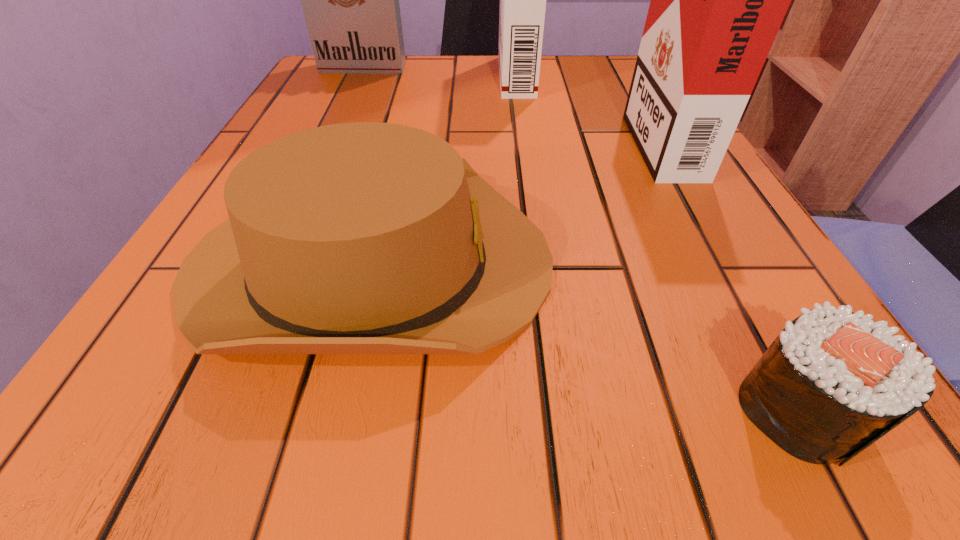
At what (x,y) coordinates should I click in order to perform the action: click on vacant space located 0.270m on the front-facing side of the nearest cigarette case. Please return your answer as a coordinate pair (x, y). This screenshot has height=540, width=960. Looking at the image, I should click on (481, 139).

This screenshot has width=960, height=540. Identify the location of vacant position located on the front-facing side of the nearest cigarette case. (453, 139).

Image resolution: width=960 pixels, height=540 pixels. I want to click on free location located 0.230m on the front-facing side of the fourth tallest object, so (x=732, y=262).

The width and height of the screenshot is (960, 540). Identify the location of free space located 0.220m on the left of the sushi. (511, 409).

The height and width of the screenshot is (540, 960). What are the coordinates of `object present at the near edge` in the screenshot? It's located at (832, 383).

At what (x,y) coordinates should I click in order to perform the action: click on cigarette case at the left edge. Please return your answer as a coordinate pair (x, y). The image size is (960, 540). Looking at the image, I should click on (350, 0).

Where is `cowboy hat that is at the left edge`? The width and height of the screenshot is (960, 540). cowboy hat that is at the left edge is located at coordinates point(355,238).

The height and width of the screenshot is (540, 960). I want to click on cigarette case that is at the right edge, so click(x=718, y=0).

Locate an element on the screen. Image resolution: width=960 pixels, height=540 pixels. sushi situated at the right edge is located at coordinates (832, 383).

The image size is (960, 540). I want to click on object at the far left corner, so click(350, 0).